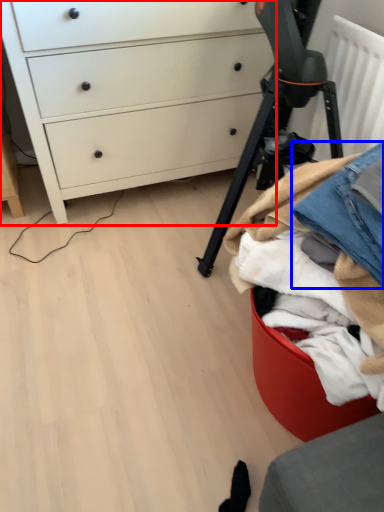
Question: Among these objects, which one is nearest to the camera, chest of drawers (highlighted by a red box) or jeans (highlighted by a blue box)?

Choices:
 (A) chest of drawers
 (B) jeans

Answer: (B)